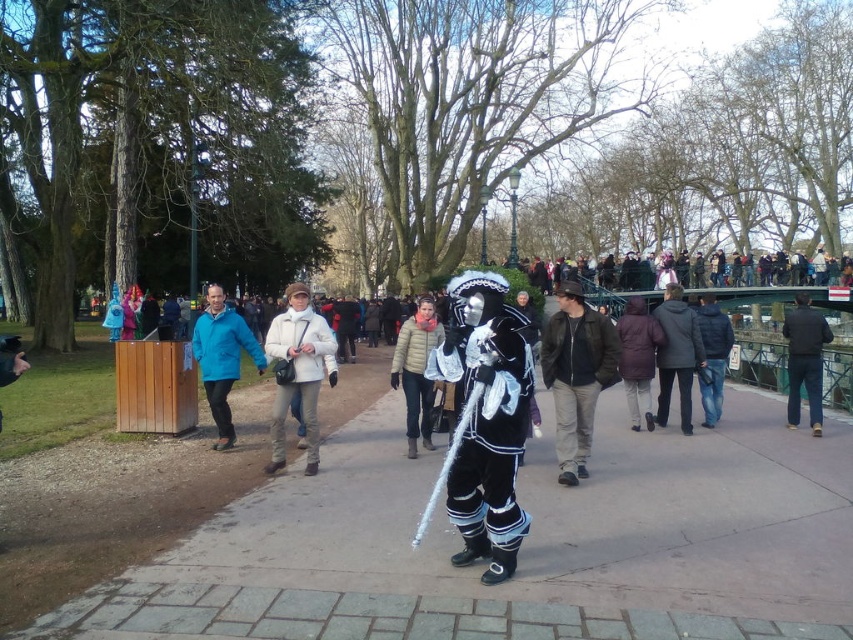
Question: Which of the following is the farthest from the observer?

Choices:
 (A) (509, 314)
 (B) (660, 390)
 (C) (682, 595)
 (D) (503, 266)

Answer: (D)

Question: Does smooth concrete pavement at center appear over matte blue jacket at center?

Choices:
 (A) no
 (B) yes

Answer: (A)

Question: Which of the following is the farthest from the observer?

Choices:
 (A) dark blue puffy jacket at center
 (B) leather jacket at center
 (C) matte blue jacket at center
 (D) white matte jacket at center

Answer: (A)

Question: Does smooth concrete pavement at center have a smaller size compared to dark clothing crowd at upper center?

Choices:
 (A) no
 (B) yes

Answer: (B)

Question: Which object appears closest to the camera in this image?

Choices:
 (A) puffy white jacket at center
 (B) dark blue puffy jacket at center

Answer: (A)

Question: Observing the image, what is the correct spatial positioning of matte blue jacket at center in reference to puffy white jacket at center?

Choices:
 (A) below
 (B) above

Answer: (B)